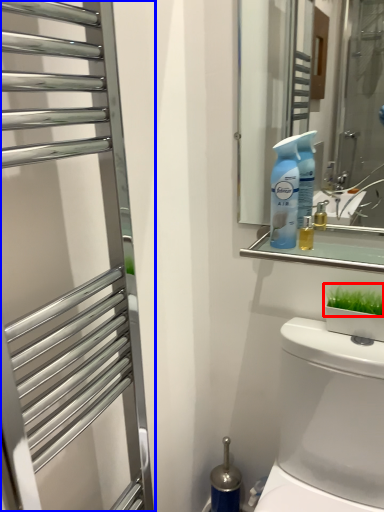
Question: Among these objects, which one is nearest to the camera, plant (highlighted by a red box) or screen door (highlighted by a blue box)?

Choices:
 (A) plant
 (B) screen door

Answer: (B)